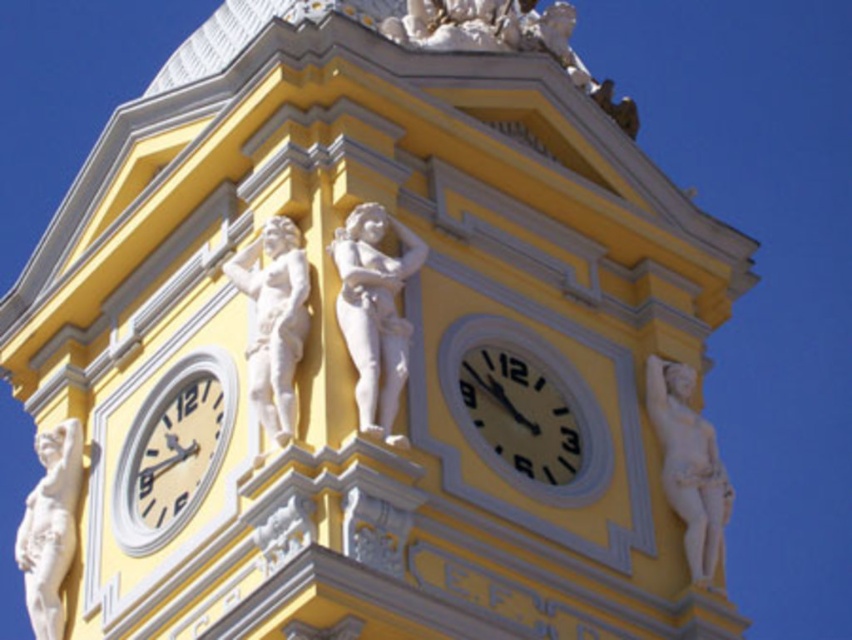
Question: Among these objects, which one is farthest from the camera?

Choices:
 (A) matte yellow clock at center
 (B) white marble statue at upper center
 (C) white marble statue at center
 (D) white marble statue at right

Answer: (D)

Question: Which point is farther to the camera?

Choices:
 (A) white marble statue at right
 (B) matte cream clock at lower left

Answer: (A)

Question: Can you confirm if matte cream clock at lower left is smaller than white marble statue at right?

Choices:
 (A) no
 (B) yes

Answer: (A)

Question: Where is white marble statue at upper center located in relation to white marble statue at right in the image?

Choices:
 (A) above
 (B) below

Answer: (A)

Question: Among these points, which one is farthest from the camera?

Choices:
 (A) (43, 632)
 (B) (695, 522)
 (C) (360, 358)
 (D) (256, 336)

Answer: (A)

Question: Does matte yellow clock at center lie in front of white marble statue at right?

Choices:
 (A) yes
 (B) no

Answer: (A)